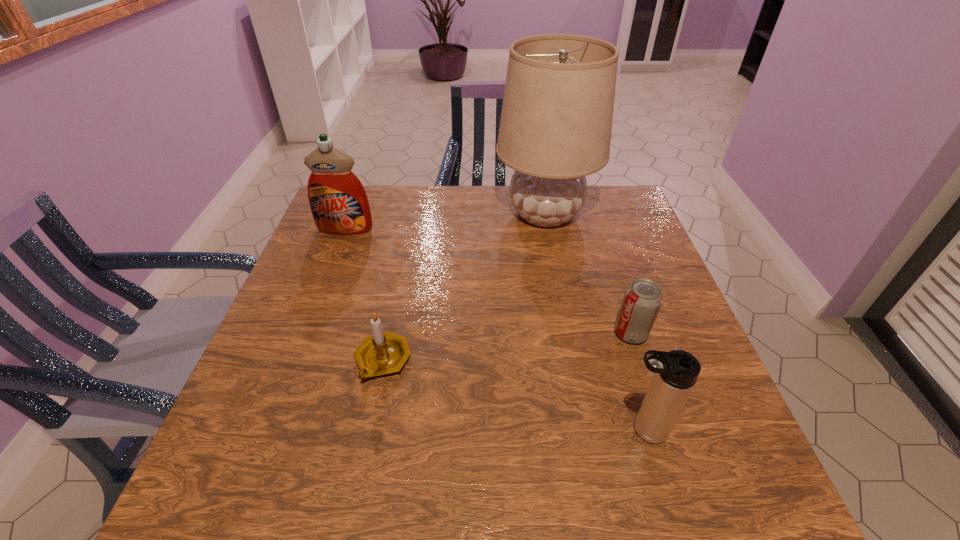
I want to click on lampshade, so click(x=556, y=121).

At what (x,y) coordinates should I click in order to perform the action: click on detergent. Please return your answer as a coordinate pair (x, y). Image resolution: width=960 pixels, height=540 pixels. Looking at the image, I should click on (339, 204).

The width and height of the screenshot is (960, 540). In order to click on the leftmost object in this screenshot , I will do `click(339, 204)`.

You are a GUI agent. You are given a task and a screenshot of the screen. Output one action in this format:
    pyautogui.click(x=<x>, y=<y>)
    Task: Click on the third shortest object
    Image resolution: width=960 pixels, height=540 pixels.
    Given the screenshot: What is the action you would take?
    pyautogui.click(x=675, y=373)

You are a GUI agent. You are given a task and a screenshot of the screen. Output one action in this format:
    pyautogui.click(x=<x>, y=<y>)
    Task: Click on the thermos bottle
    The image size is (960, 540).
    Given the screenshot: What is the action you would take?
    pyautogui.click(x=675, y=373)

I want to click on candle holder, so click(x=383, y=353).

The width and height of the screenshot is (960, 540). I want to click on soda can, so coord(643,297).

Where is `vacant space located on the front of the tallest object`? This screenshot has height=540, width=960. vacant space located on the front of the tallest object is located at coordinates (x=561, y=292).

Find the location of a particular element. This screenshot has height=540, width=960. free space located on the front surface of the leftmost object is located at coordinates (301, 343).

Identify the location of vacant space located 0.110m on the handle side of the third shortest object. (558, 430).